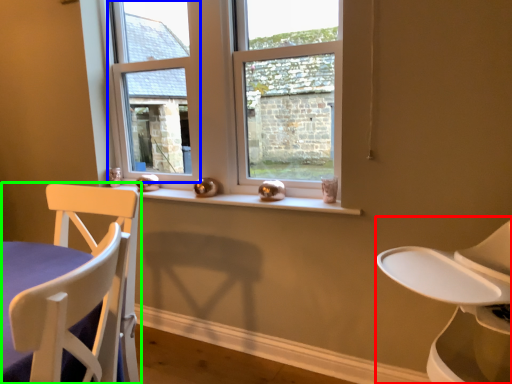
Question: Based on their relative distances, which object is nearer to feeding chair (highlighted by a red box)? Choose from window frame (highlighted by a blue box) and chair (highlighted by a green box).

Choices:
 (A) window frame
 (B) chair

Answer: (B)